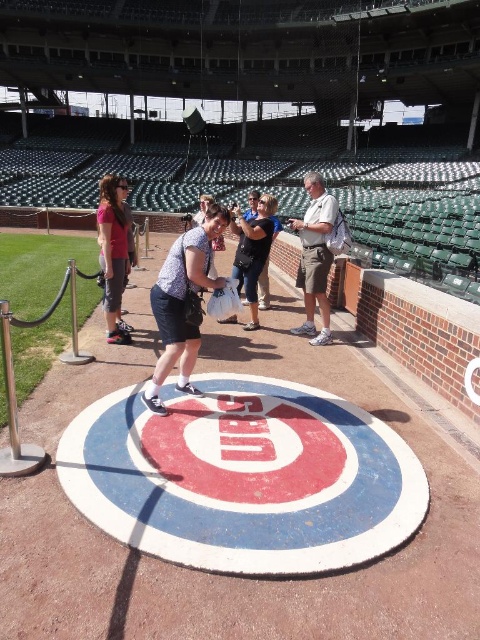
Is point (163, 355) in front of point (253, 301)?

Yes, it is.

Is point (158, 289) in front of point (271, 234)?

Yes.

At what (x,y) coordinates should I click in order to perform the action: click on matte blue shorts at center. Please return your answer as a coordinate pair (x, y). Looking at the image, I should click on (182, 301).

Can you confirm if khaki shorts at center is positioned to the right of matte pink shirt at left?

Yes, khaki shorts at center is to the right of matte pink shirt at left.

Looking at this image, can you confirm if khaki shorts at center is smaller than matte pink shirt at left?

Incorrect, khaki shorts at center is not smaller in size than matte pink shirt at left.

Locate an element on the screen. The image size is (480, 640). khaki shorts at center is located at coordinates (314, 257).

Does matte blue shorts at center appear on the right side of khaki shorts at center?

Incorrect, matte blue shorts at center is not on the right side of khaki shorts at center.

Does point (156, 291) come in front of point (315, 240)?

That is True.

You are a GUI agent. You are given a task and a screenshot of the screen. Output one action in this format:
    pyautogui.click(x=<x>, y=<y>)
    Task: Click on the matte blue shorts at center
    
    Given the screenshot: What is the action you would take?
    pyautogui.click(x=182, y=301)